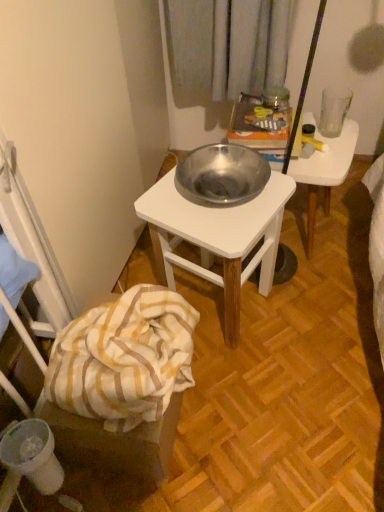
Identify the location of vacant area on top of metallic white table at center (from a real-world perspective). (221, 196).